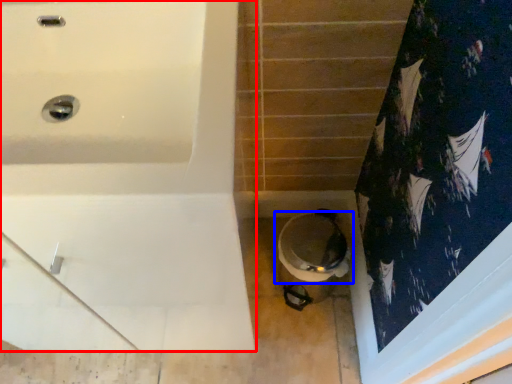
Question: Among these objects, which one is nearest to the camera, bathtub (highlighted by a red box) or toilet (highlighted by a blue box)?

Choices:
 (A) bathtub
 (B) toilet

Answer: (A)